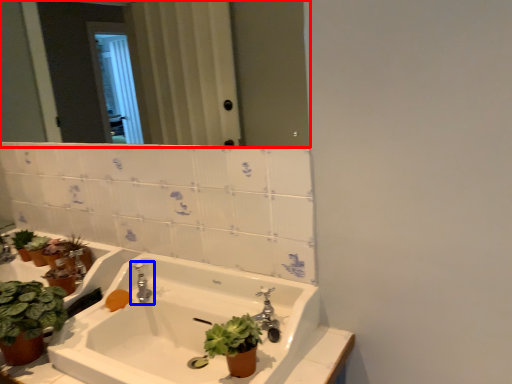
Question: Among these objects, which one is farthest to the camera, mirror (highlighted by a red box) or tap (highlighted by a blue box)?

Choices:
 (A) mirror
 (B) tap

Answer: (B)